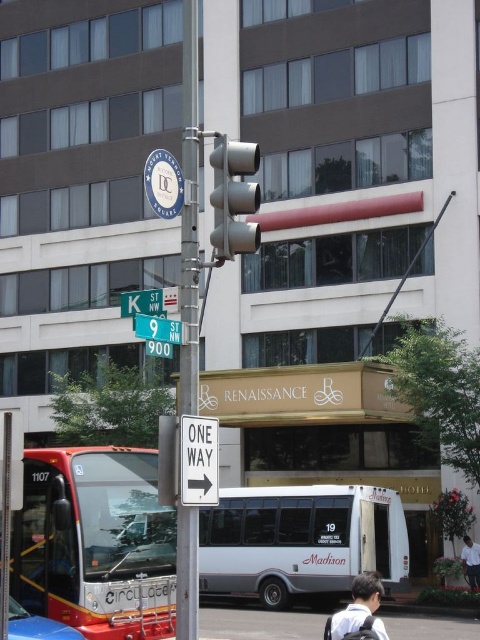
You are a delivery person trying to park your 2.5 meter wide van between the white matte bus at center and the metallic pole at center. Can your van fit in the space between them?

The white matte bus at center is narrower than the metallic pole at center, but the description only provides a comparison of their widths, not the actual space between them. Without knowing the exact distance between the bus and the pole, it is impossible to determine if the van will fit.

You are standing on the sidewalk in front of the Renaissance Hotel and notice two points marked on the traffic light pole. The first point is at coordinates point (126, 467) and the second is at point (338, 616). Which point is closer to you?

Point (126, 467) is closer to you because it is further to the viewer than point (338, 616).